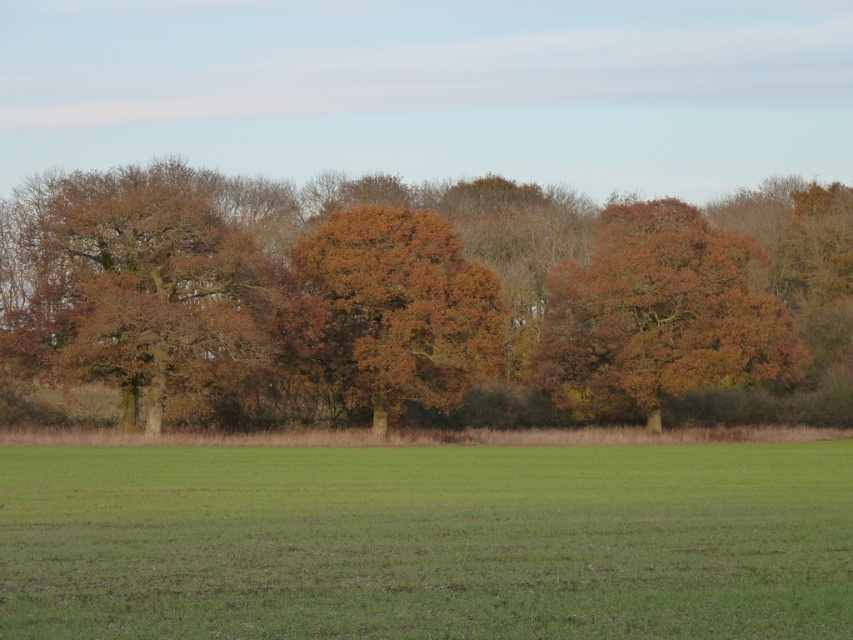
You are a gardener who wants to plant a new tree in the field. The tree you want to plant requires at least 10 meters of space between it and any other tree to grow properly. You see the green grass at center and the brown matte tree at center. Can you plant your new tree between them without violating the spacing requirement?

The distance between the green grass at center and the brown matte tree at center is 11.42 meters. Since the required spacing is at least 10 meters, the new tree can be planted between them as the existing distance meets the requirement.

You are standing at the center of the field and want to walk towards the brown matte tree at left. Which direction should you head in?

The brown matte tree at left is located at point 0.453 on the x and 0.162 on the y, so you should head towards the left direction to reach it.

You are standing in the rural landscape scene. There are two points marked in the image. The first point is at coordinates point (x=799, y=634) and the second is at point (x=337, y=358). Which point is closer to you?

Point (x=799, y=634) is closer to the viewer than point (x=337, y=358).